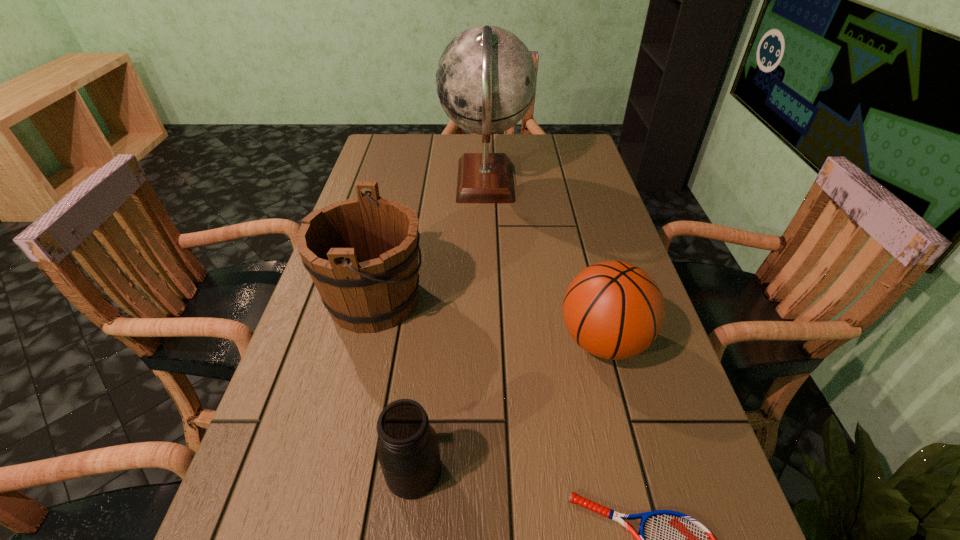
The image size is (960, 540). I want to click on globe, so click(x=486, y=79).

Where is `the tallest object`? the tallest object is located at coordinates click(x=486, y=79).

Identify the location of the second tallest object. The height and width of the screenshot is (540, 960). (x=362, y=253).

Where is `basketball`? This screenshot has width=960, height=540. basketball is located at coordinates (614, 310).

Image resolution: width=960 pixels, height=540 pixels. Identify the location of the fourth tallest object. (408, 451).

I want to click on vacant space located at the equator of the globe, so click(x=382, y=183).

The width and height of the screenshot is (960, 540). In order to click on vacant space located at the equator of the globe in this screenshot , I will do `click(417, 183)`.

You are a GUI agent. You are given a task and a screenshot of the screen. Output one action in this format:
    pyautogui.click(x=<x>, y=<y>)
    Task: Click on the vacant region located at the equator of the globe
    This screenshot has width=960, height=540.
    Given the screenshot: What is the action you would take?
    pyautogui.click(x=410, y=183)

I want to click on vacant space located 0.050m on the side of the wine bucket with the handle for carrying, so click(447, 300).

Find the location of a particular element. This screenshot has width=960, height=540. vacant space located on the front of the basketball is located at coordinates (620, 408).